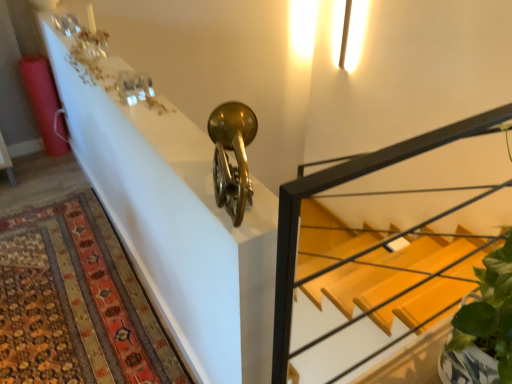
Find the location of a particular element. blank area beneath carpeted rug at lower left (from a real-world perspective) is located at coordinates (64, 291).